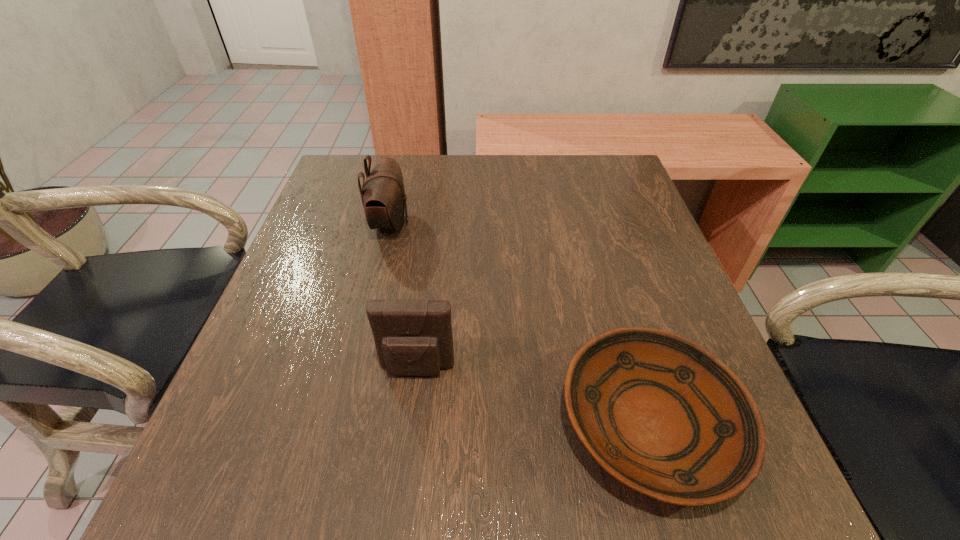
Find the location of `object present at the right edge`. object present at the right edge is located at coordinates (662, 415).

This screenshot has width=960, height=540. Find the location of `object that is positioned at the far left corner`. object that is positioned at the far left corner is located at coordinates (383, 196).

At what (x,y) coordinates should I click in order to perform the action: click on object that is at the near right corner. Please return your answer as a coordinate pair (x, y). Image resolution: width=960 pixels, height=540 pixels. Looking at the image, I should click on (662, 415).

You are a GUI agent. You are given a task and a screenshot of the screen. Output one action in this format:
    pyautogui.click(x=<x>, y=<y>)
    Task: Click on the vacant space at the far edge of the desktop
    The image size is (960, 540).
    Given the screenshot: What is the action you would take?
    pyautogui.click(x=411, y=172)

In the image, there is a desktop. Identify the location of free space at the left edge. (342, 251).

The width and height of the screenshot is (960, 540). I want to click on free region at the right edge of the desktop, so click(x=645, y=213).

In the image, there is a desktop. Identify the location of vacant space at the far left corner. The image size is (960, 540). (362, 165).

Where is `blank space at the far right corner`? The image size is (960, 540). blank space at the far right corner is located at coordinates (584, 181).

Identify the location of free space at the near right corner of the desktop. (737, 510).

This screenshot has height=540, width=960. In order to click on vacant area that lies between the plate and the farthest object in this screenshot , I will do `click(520, 323)`.